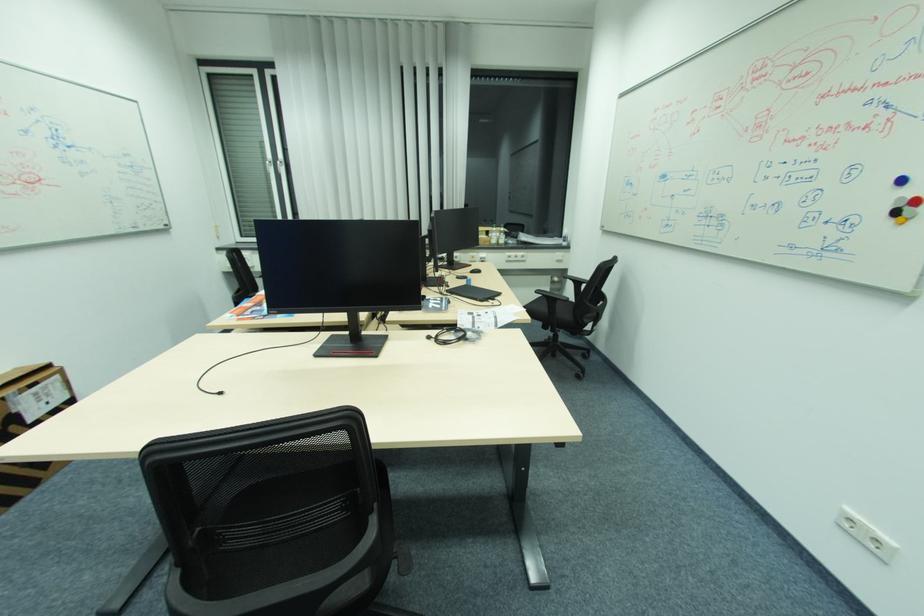
Describe the element at coordinates (281, 164) in the screenshot. I see `the silver window handle` at that location.